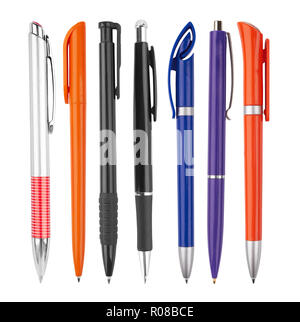
Where is `pens`? The height and width of the screenshot is (322, 300). pens is located at coordinates (255, 182), (217, 199), (186, 196), (143, 185), (110, 189), (76, 170), (41, 157).